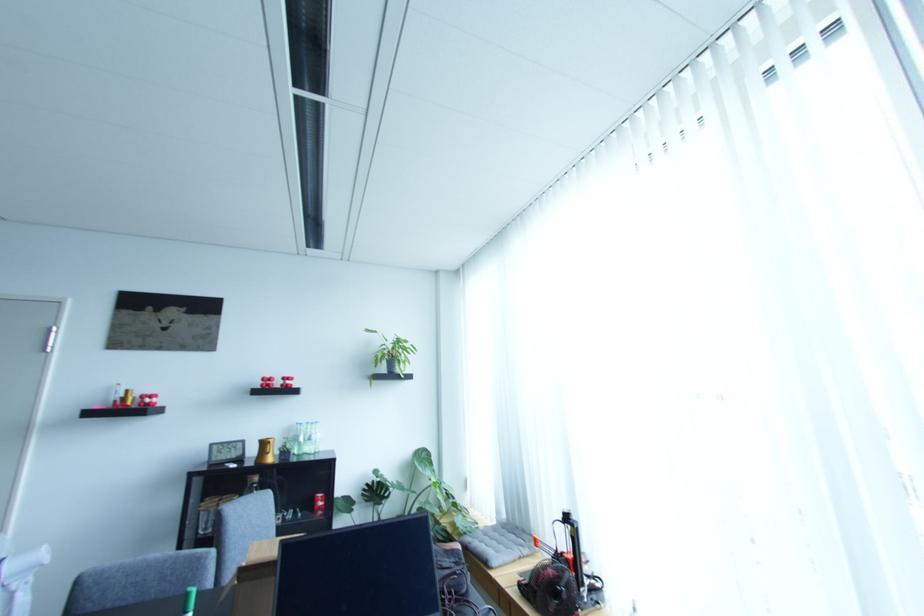
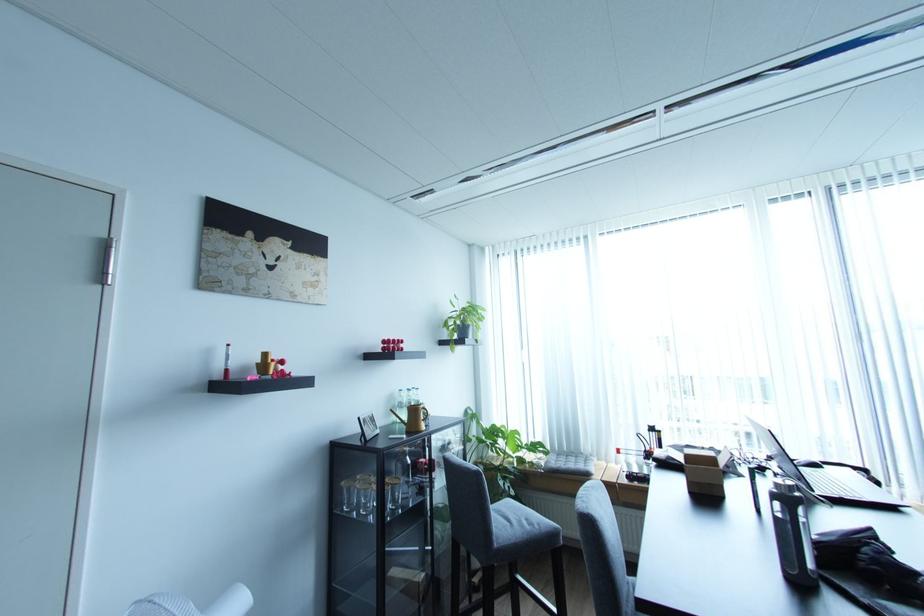
Find the pixel in the second image that matches (273,377) in the first image.

(395, 339)